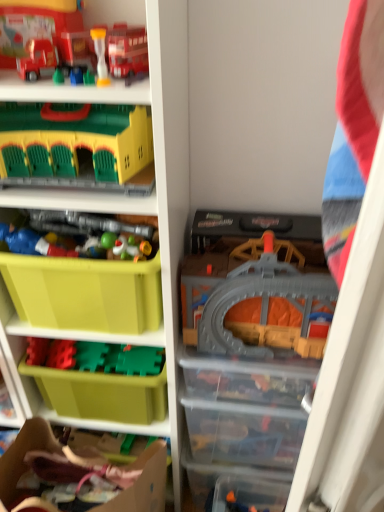
Question: Considering the positions of point (235, 317) and point (36, 86), is point (235, 317) closer or farther from the camera than point (36, 86)?

Choices:
 (A) closer
 (B) farther

Answer: (B)

Question: Which is correct: gray plastic train set at center, the sixth toy viewed from the top, is inside matte plastic shelf at center, or outside of it?

Choices:
 (A) inside
 (B) outside

Answer: (B)

Question: Estimate the real-world distances between objects in this image. Which object is closer to the orange matte toy car at lower center, which appears as the 1th toy when ordered from the bottom?

Choices:
 (A) green plastic building block at upper left, which appears as the third toy when viewed from the top
 (B) translucent plastic hourglass at upper left, the sixth toy positioned from the bottom
 (C) matte plastic toy at left, the third toy ordered from the bottom
 (D) green plastic storage box at lower left
 (E) plastic toy soldiers at center, the fourth toy ordered from the bottom

Answer: (D)

Question: Considering the real-world distances, which object is farthest from the orange matte toy car at lower center, which appears as the 1th toy when ordered from the bottom?

Choices:
 (A) matte plastic toy car at upper left, which is the 1th toy in top-to-bottom order
 (B) matte plastic shelf at center
 (C) green plastic storage box at lower left
 (D) cardboard at lower left
 (E) green plastic building block at upper left, the fifth toy in the bottom-to-top sequence

Answer: (A)